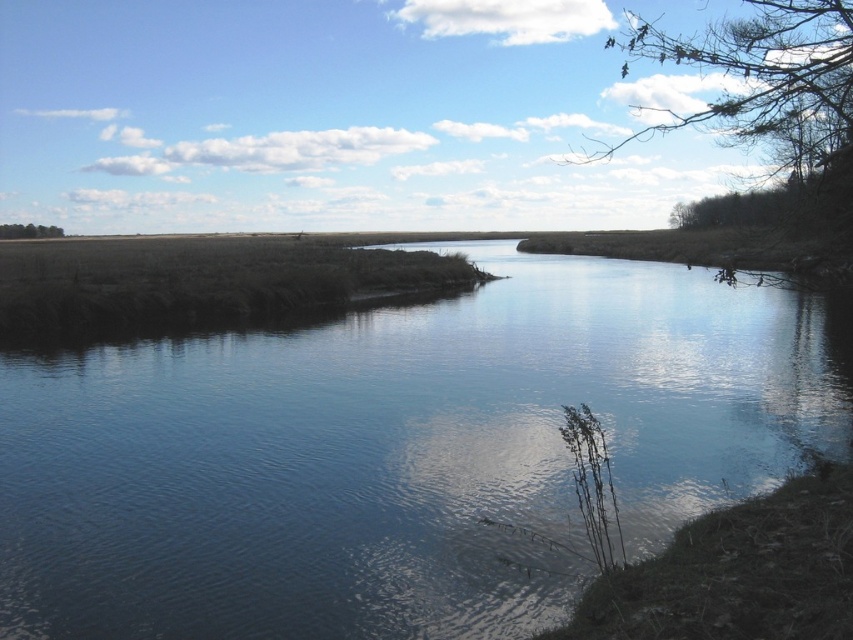
You are a bird flying over the serene natural landscape. You want to land on the bare branches at upper right. Based on the coordinates provided, can you determine if the branches are located in the upper part of the image?

Yes, the bare branches at upper right are located at point 0.167 on the x axis and 0.906 on the y axis, which places them in the upper part of the image since the y coordinate is close to 1, indicating proximity to the top edge.

You are an artist sketching the landscape and want to ensure the proportions between the clear water at center and the bare branches at upper right are accurate. Based on the scene, which object is taller in the image?

The clear water at center is not as tall as the bare branches at upper right, so the bare branches at upper right are taller.

You are planning to plant a new tree between the bare branches at upper right and the green leafy tree at left. The new tree requires a minimum of 100 meters of space between it and any existing trees. Can you plant the new tree in this location without violating the spacing requirement?

The distance between the bare branches at upper right and the green leafy tree at left is 131.91 meters. Since the new tree requires at least 100 meters of space, planting it between them would leave enough room as long as it is placed appropriately within the 131.91 meters distance.